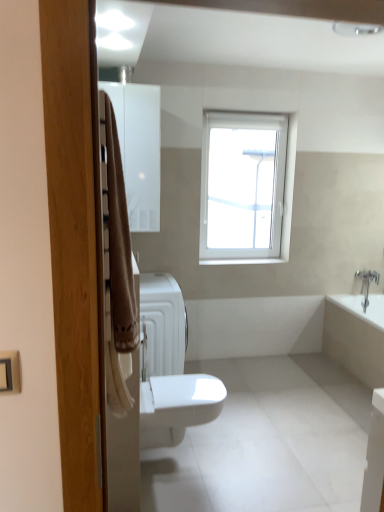
This screenshot has height=512, width=384. I want to click on white glossy medicine cabinet at upper left, so click(x=139, y=150).

The width and height of the screenshot is (384, 512). What do you see at coordinates (162, 326) in the screenshot?
I see `white matte radiator at center` at bounding box center [162, 326].

Locate an element on the screen. The height and width of the screenshot is (512, 384). white matte radiator at center is located at coordinates (162, 326).

Find the location of a particular element. The height and width of the screenshot is (512, 384). white glossy bathtub at lower right is located at coordinates (356, 336).

Locate an element on the screen. white glossy medicine cabinet at upper left is located at coordinates (139, 150).

Considering the sizes of objects white plastic window at upper center and white glossy bidet at center in the image provided, who is thinner, white plastic window at upper center or white glossy bidet at center?

Thinner between the two is white plastic window at upper center.

Looking at this image, from their relative heights in the image, would you say white plastic window at upper center is taller or shorter than white glossy bidet at center?

In the image, white plastic window at upper center appears to be taller than white glossy bidet at center.

This screenshot has height=512, width=384. I want to click on bidet that is below the white plastic window at upper center (from the image's perspective), so click(x=177, y=407).

Is white plastic window at upper center located outside white glossy bidet at center?

Indeed, white plastic window at upper center is completely outside white glossy bidet at center.

Is point (216, 123) closer or farther from the camera than point (152, 207)?

Point (216, 123).

Is white plastic window at upper center inside the boundaries of white glossy medicine cabinet at upper left, or outside?

white plastic window at upper center is outside white glossy medicine cabinet at upper left.

From the image's perspective, which one is positioned higher, white plastic window at upper center or white glossy medicine cabinet at upper left?

white glossy medicine cabinet at upper left, from the image's perspective.

Is white matte radiator at center shorter than white glossy bidet at center?

No.

Between white matte radiator at center and white glossy bidet at center, which one appears on the left side from the viewer's perspective?

From the viewer's perspective, white matte radiator at center appears more on the left side.

Is white matte radiator at center next to white glossy bidet at center and touching it?

No, white matte radiator at center is not in contact with white glossy bidet at center.

Can you confirm if white matte radiator at center is smaller than white glossy bidet at center?

No.

Which object is wider, white glossy medicine cabinet at upper left or white matte radiator at center?

white glossy medicine cabinet at upper left is wider.

Is white glossy medicine cabinet at upper left to the left or to the right of white matte radiator at center in the image?

white glossy medicine cabinet at upper left is positioned on white matte radiator at center's left side.

Is there a large distance between white glossy medicine cabinet at upper left and white matte radiator at center?

white glossy medicine cabinet at upper left is near white matte radiator at center, not far away.

Is point (225, 180) positioned behind point (363, 322)?

That is True.

From the image's perspective, which is above, white plastic window at upper center or white glossy bathtub at lower right?

white plastic window at upper center appears higher in the image.

Between white plastic window at upper center and white glossy bathtub at lower right, which one is positioned in front?

Positioned in front is white glossy bathtub at lower right.

In the scene shown: How different are the orientations of white plastic window at upper center and white glossy bathtub at lower right in degrees?

91 degrees separate the facing orientations of white plastic window at upper center and white glossy bathtub at lower right.

In the image, is white glossy bathtub at lower right on the left side or the right side of white glossy bidet at center?

In the image, white glossy bathtub at lower right appears on the right side of white glossy bidet at center.

Considering the sizes of objects white glossy bathtub at lower right and white glossy bidet at center in the image provided, who is smaller, white glossy bathtub at lower right or white glossy bidet at center?

Smaller between the two is white glossy bidet at center.

In the scene shown: From a real-world perspective, does white glossy bathtub at lower right stand above white glossy bidet at center?

Indeed, from a real-world perspective, white glossy bathtub at lower right stands above white glossy bidet at center.

Considering the sizes of objects white glossy bathtub at lower right and white glossy bidet at center in the image provided, who is shorter, white glossy bathtub at lower right or white glossy bidet at center?

white glossy bidet at center is shorter.

Can you confirm if white glossy bathtub at lower right is taller than white glossy medicine cabinet at upper left?

Incorrect, the height of white glossy bathtub at lower right is not larger of that of white glossy medicine cabinet at upper left.

Is white glossy bathtub at lower right completely or partially outside of white glossy medicine cabinet at upper left?

Absolutely, white glossy bathtub at lower right is external to white glossy medicine cabinet at upper left.

Which object is closer to the camera, white glossy bathtub at lower right or white glossy medicine cabinet at upper left?

white glossy medicine cabinet at upper left.

From a real-world perspective, between white glossy bathtub at lower right and white glossy medicine cabinet at upper left, who is vertically lower?

white glossy bathtub at lower right is physically lower.

Image resolution: width=384 pixels, height=512 pixels. I want to click on window located above the white glossy bidet at center (from the image's perspective), so click(x=246, y=187).

You are a GUI agent. You are given a task and a screenshot of the screen. Output one action in this format:
    pyautogui.click(x=<x>, y=<y>)
    Task: Click on the medicine cabinet on the left side of white plastic window at upper center
    Image resolution: width=384 pixels, height=512 pixels.
    Given the screenshot: What is the action you would take?
    pyautogui.click(x=139, y=150)

Considering their positions, is white matte radiator at center positioned further to white plastic window at upper center than white glossy bathtub at lower right?

white glossy bathtub at lower right is positioned further to the anchor white plastic window at upper center.

Considering their positions, is beige fabric towel at left positioned further to white glossy bathtub at lower right than white matte radiator at center?

beige fabric towel at left.

When comparing their distances from white glossy bidet at center, does beige fabric towel at left or white matte radiator at center seem closer?

beige fabric towel at left lies closer to white glossy bidet at center than the other object.

Considering their positions, is beige fabric towel at left positioned closer to white glossy bidet at center than white plastic window at upper center?

Among the two, beige fabric towel at left is located nearer to white glossy bidet at center.

Based on their spatial positions, is white glossy bidet at center or white glossy medicine cabinet at upper left closer to white plastic window at upper center?

The object closer to white plastic window at upper center is white glossy medicine cabinet at upper left.

Looking at the image, which one is located further to white glossy bidet at center, white matte radiator at center or white plastic window at upper center?

white plastic window at upper center is further to white glossy bidet at center.

When comparing their distances from white glossy bathtub at lower right, does white glossy medicine cabinet at upper left or beige fabric towel at left seem further?

beige fabric towel at left lies further to white glossy bathtub at lower right than the other object.

Looking at the image, which one is located further to white glossy medicine cabinet at upper left, white glossy bathtub at lower right or white plastic window at upper center?

white glossy bathtub at lower right is positioned further to the anchor white glossy medicine cabinet at upper left.

Identify the location of window that lies between white glossy medicine cabinet at upper left and white matte radiator at center from top to bottom. The image size is (384, 512). (246, 187).

I want to click on window between white glossy medicine cabinet at upper left and white glossy bidet at center in the vertical direction, so click(x=246, y=187).

The width and height of the screenshot is (384, 512). What are the coordinates of `bidet located between white matte radiator at center and white glossy bathtub at lower right in the left-right direction` in the screenshot? It's located at (177, 407).

Locate an element on the screen. bath between beige fabric towel at left and white plastic window at upper center along the z-axis is located at coordinates (356, 336).